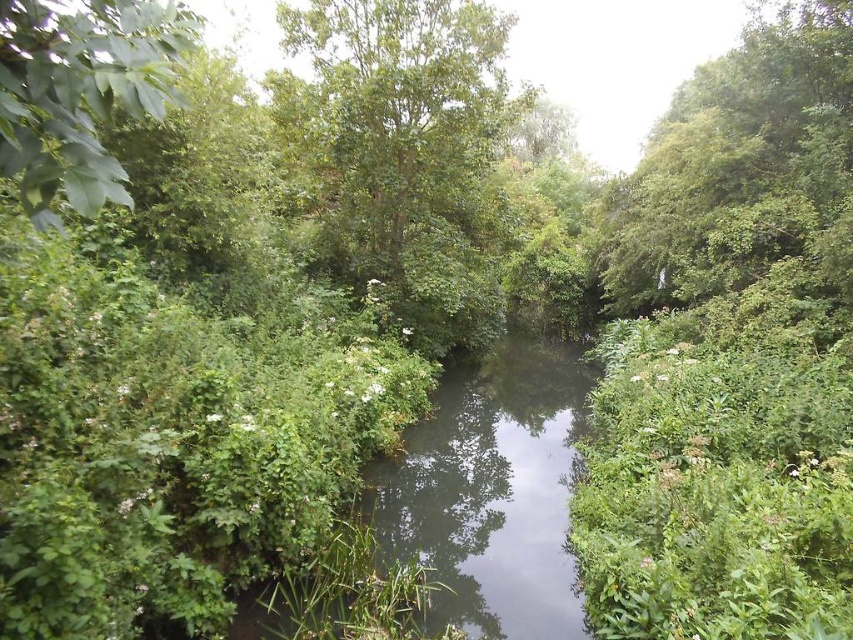
Question: Which point is farther to the camera?

Choices:
 (A) (517, 106)
 (B) (401, 515)

Answer: (A)

Question: Which of the following is the closest to the observer?

Choices:
 (A) (442, 392)
 (B) (486, 56)
 (C) (90, 48)

Answer: (C)

Question: In this image, where is clear water at center located relative to green leafy tree at upper left?

Choices:
 (A) right
 (B) left

Answer: (A)

Question: Is green leafy tree at center positioned in front of clear water at center?

Choices:
 (A) yes
 (B) no

Answer: (B)

Question: Is green leafy tree at center positioned behind green leafy tree at upper left?

Choices:
 (A) yes
 (B) no

Answer: (A)

Question: Which object is the closest to the green leafy tree at center?

Choices:
 (A) clear water at center
 (B) green leafy tree at upper left

Answer: (A)